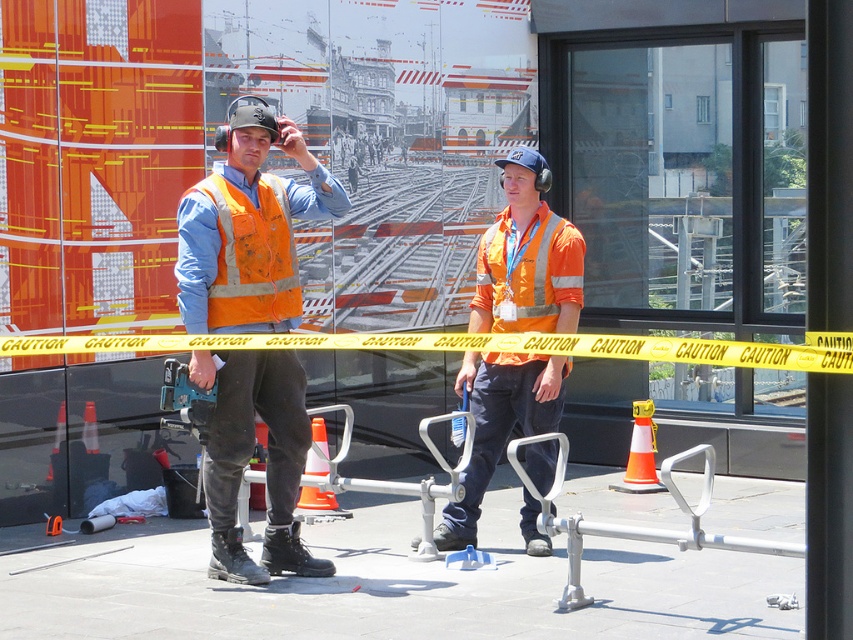
Question: Considering the real-world distances, which object is farthest from the reflective orange safety vest at left?

Choices:
 (A) matte orange safety vest at center
 (B) metallic train track at center

Answer: (B)

Question: Estimate the real-world distances between objects in this image. Which object is farther from the matte orange safety vest at center?

Choices:
 (A) metallic train track at center
 (B) orange reflective vest at center
 (C) reflective orange safety vest at left

Answer: (A)

Question: Does orange reflective vest at center lie in front of metallic train track at center?

Choices:
 (A) yes
 (B) no

Answer: (A)

Question: Does matte orange safety vest at center appear on the left side of reflective orange safety vest at left?

Choices:
 (A) no
 (B) yes

Answer: (A)

Question: Which point is closer to the camera?

Choices:
 (A) (347, 234)
 (B) (292, 189)
 (C) (265, 241)

Answer: (C)

Question: Does orange reflective vest at center have a greater width compared to reflective orange safety vest at left?

Choices:
 (A) yes
 (B) no

Answer: (A)